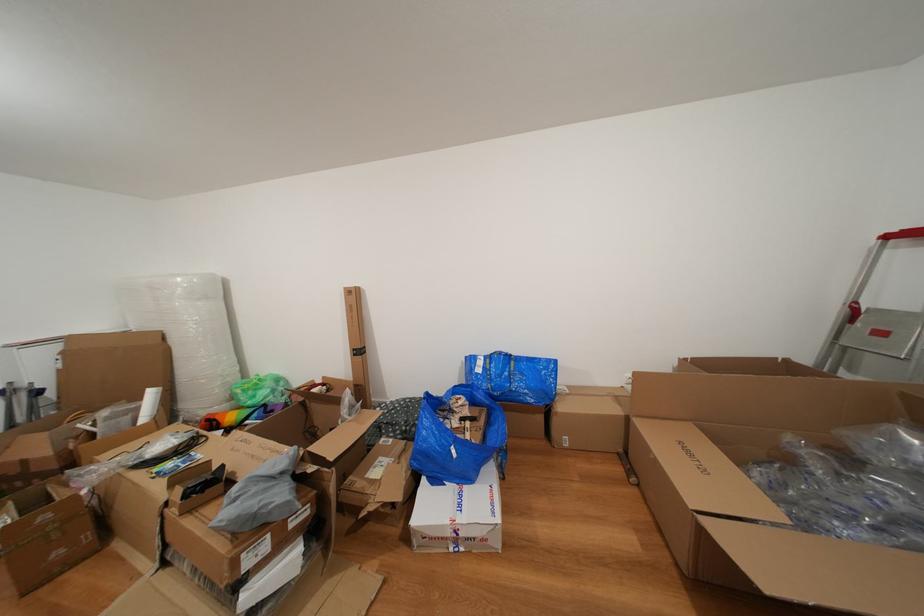
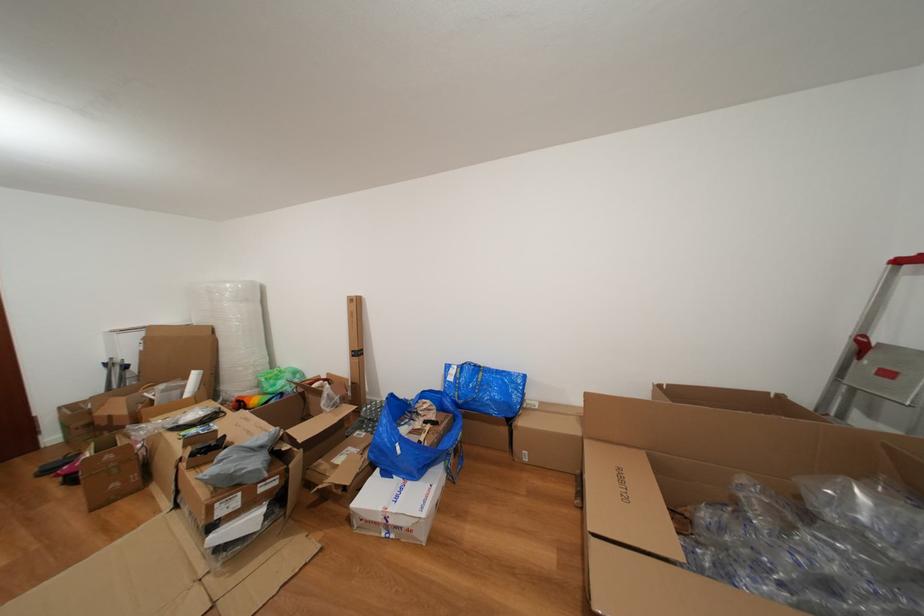
Find the pixel in the second image that matches (188,297) in the first image.

(237, 301)